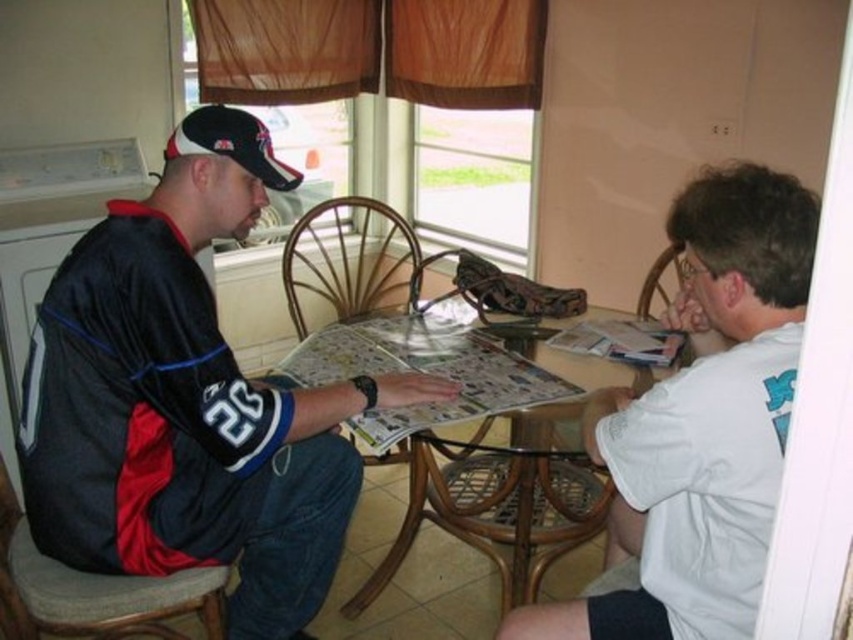
Question: Can you confirm if clear glass table at center is wider than bamboo chair at center?

Choices:
 (A) yes
 (B) no

Answer: (A)

Question: Which of the following is the farthest from the observer?

Choices:
 (A) white matte shirt at upper right
 (B) brown woven chair at lower left

Answer: (B)

Question: Observing the image, what is the correct spatial positioning of black fabric baseball cap at upper left in reference to wicker chair at right?

Choices:
 (A) below
 (B) above

Answer: (B)

Question: Which object is the farthest from the black jersey at center?

Choices:
 (A) black fabric baseball cap at upper left
 (B) bamboo chair at center
 (C) wicker chair at right

Answer: (C)

Question: Does clear glass table at center appear on the left side of black fabric baseball cap at upper left?

Choices:
 (A) no
 (B) yes

Answer: (A)

Question: Which point is farther to the camera?

Choices:
 (A) 381,227
 (B) 706,419
 (C) 271,180

Answer: (A)